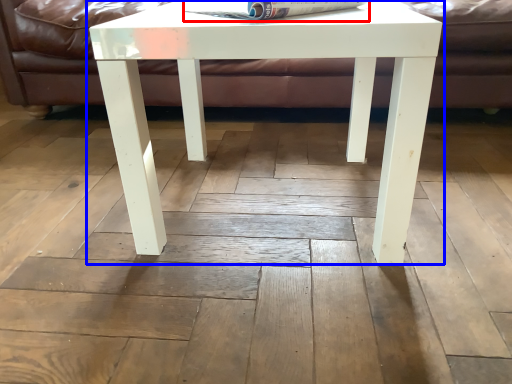
Question: Which point is closer to the camera, magazine (highlighted by a red box) or table (highlighted by a blue box)?

Choices:
 (A) magazine
 (B) table

Answer: (B)